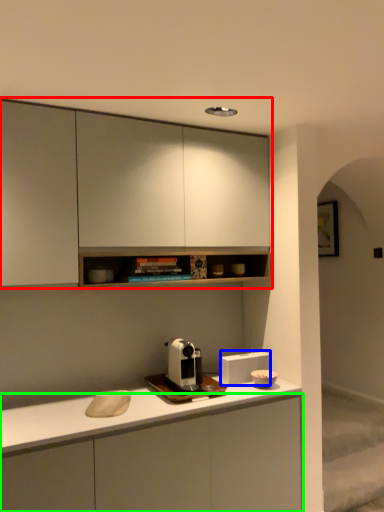
Question: Estimate the real-world distances between objects in this image. Which object is closer to cabinetry (highlighted by a red box), appliance (highlighted by a blue box) or cabinetry (highlighted by a green box)?

Choices:
 (A) appliance
 (B) cabinetry

Answer: (A)